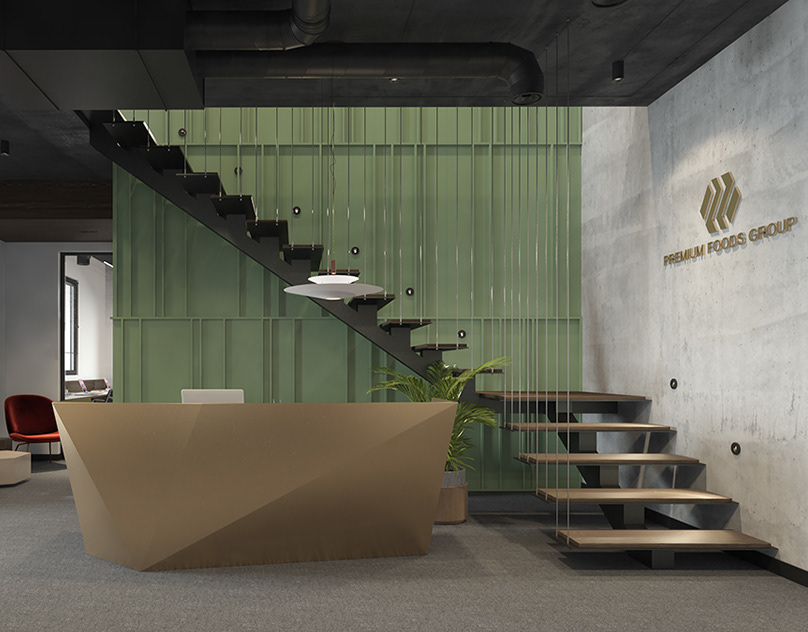
Identify the location of staircase. (268, 248), (617, 483).